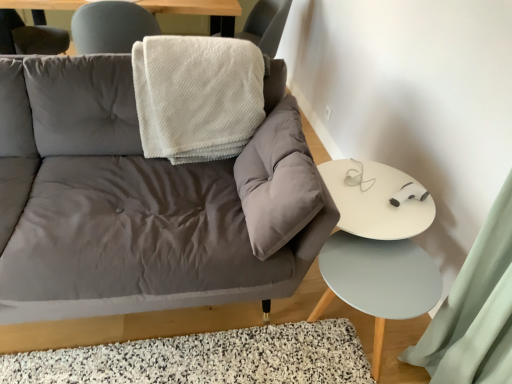
Question: From a real-world perspective, is white textured blanket at upper center physically located above or below white fluffy blanket at upper center?

Choices:
 (A) above
 (B) below

Answer: (B)

Question: Which is correct: white textured blanket at upper center is inside white fluffy blanket at upper center, or outside of it?

Choices:
 (A) outside
 (B) inside

Answer: (A)

Question: Considering the real-world distances, which object is closest to the white glossy table at right?

Choices:
 (A) white shaggy rug at lower center
 (B) white textured blanket at upper center
 (C) matte gray couch at center
 (D) light blue matte side table at lower right
 (E) white fluffy blanket at upper center

Answer: (D)

Question: Considering the real-world distances, which object is closest to the light blue matte side table at lower right?

Choices:
 (A) white textured blanket at upper center
 (B) white glossy table at right
 (C) matte gray couch at center
 (D) white fluffy blanket at upper center
 (E) white shaggy rug at lower center

Answer: (B)